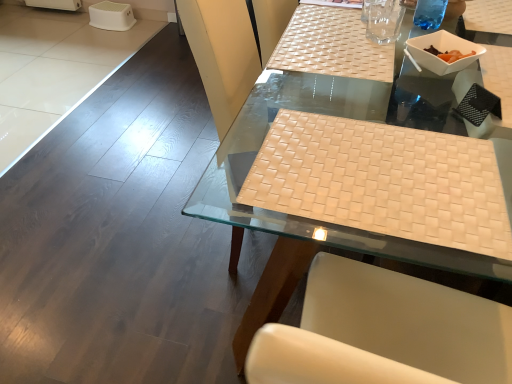
Question: Considering the positions of white plastic bowl at upper right and transparent glass at upper center in the image, is white plastic bowl at upper right wider or thinner than transparent glass at upper center?

Choices:
 (A) wide
 (B) thin

Answer: (A)

Question: From a real-world perspective, is white plastic bowl at upper right positioned above or below transparent glass at upper center?

Choices:
 (A) below
 (B) above

Answer: (A)

Question: Estimate the real-world distances between objects in this image. Which object is closer to the beige woven mat at center?

Choices:
 (A) white plastic bowl at upper right
 (B) transparent glass at upper center
 (C) transparent plastic cup at upper right
 (D) white woven placemat at center

Answer: (D)

Question: Estimate the real-world distances between objects in this image. Which object is closer to the beige woven mat at center?

Choices:
 (A) white woven placemat at center
 (B) white plastic bowl at upper right
 (C) transparent plastic cup at upper right
 (D) transparent glass at upper center

Answer: (A)